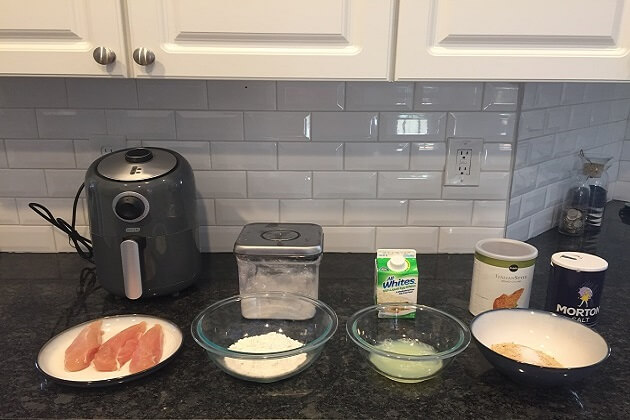
Identify the location of cookie jar. Image resolution: width=630 pixels, height=420 pixels. (285, 268).